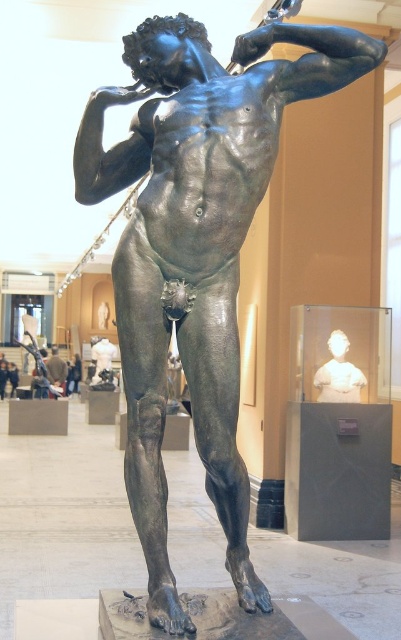
Does white marble bust at center appear under bronze statue at center?

Actually, white marble bust at center is above bronze statue at center.

Measure the distance from white marble bust at center to bronze statue at center.

They are 17.18 meters apart.

Which is behind, point (326, 385) or point (58, 384)?

The point (58, 384) is behind.

You are a GUI agent. You are given a task and a screenshot of the screen. Output one action in this format:
    pyautogui.click(x=<x>, y=<y>)
    Task: Click on the white marble bust at center
    This screenshot has width=401, height=640.
    Given the screenshot: What is the action you would take?
    pyautogui.click(x=338, y=372)